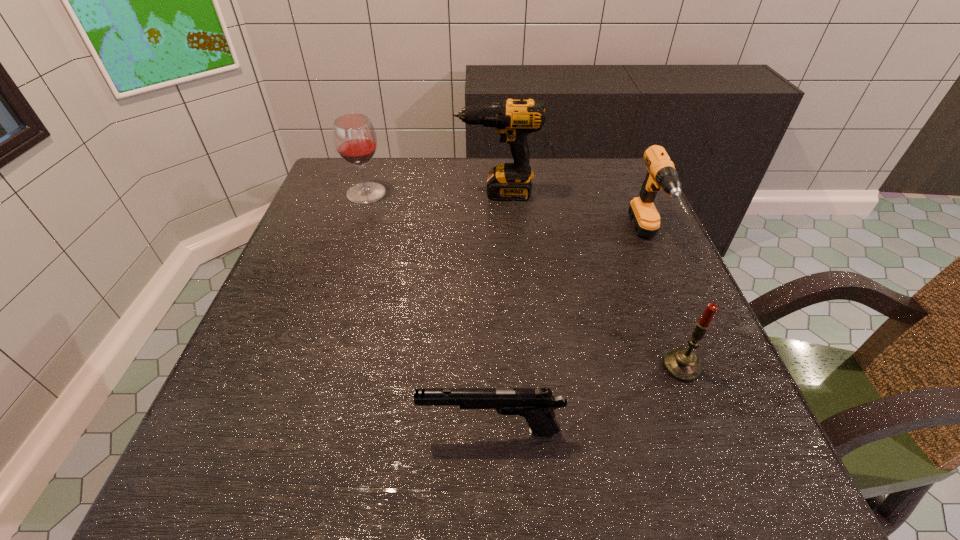
The width and height of the screenshot is (960, 540). I want to click on the third closest object to the gun, so click(513, 119).

Choose which object is the third nearest neighbor to the left drill. Please provide its 2D coordinates. Your answer should be formatted as a tuple, i.e. [(x, y)], where the tuple contains the x and y coordinates of a point satisfying the conditions above.

[(682, 364)]

Locate an element on the screen. Image resolution: width=960 pixels, height=540 pixels. vacant space that satisfies the following two spatial constraints: 1. on the front side of the candle; 2. at the aiming end of the nearest object is located at coordinates (706, 430).

Identify the location of free space that satisfies the following two spatial constraints: 1. at the tip of the fourth tallest object; 2. on the left side of the farther drill. This screenshot has width=960, height=540. pos(506,367).